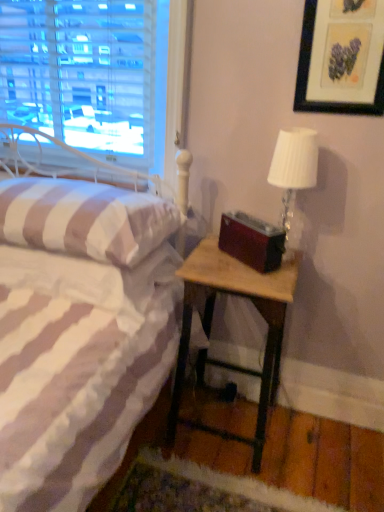
Question: Based on their sizes in the image, would you say white striped fabric pillow at left is bigger or smaller than wooden nightstand at lower right?

Choices:
 (A) big
 (B) small

Answer: (B)

Question: Considering their positions, is white striped fabric pillow at left located in front of or behind wooden nightstand at lower right?

Choices:
 (A) behind
 (B) front

Answer: (B)

Question: Estimate the real-world distances between objects in this image. Which object is closer to the white textured lampshade at upper right?

Choices:
 (A) matte black picture frame at upper right
 (B) white striped fabric pillow at left
 (C) wooden nightstand at lower right

Answer: (A)

Question: Estimate the real-world distances between objects in this image. Which object is closer to the white striped fabric pillow at left?

Choices:
 (A) wooden nightstand at lower right
 (B) matte black picture frame at upper right
 (C) white textured lampshade at upper right

Answer: (A)